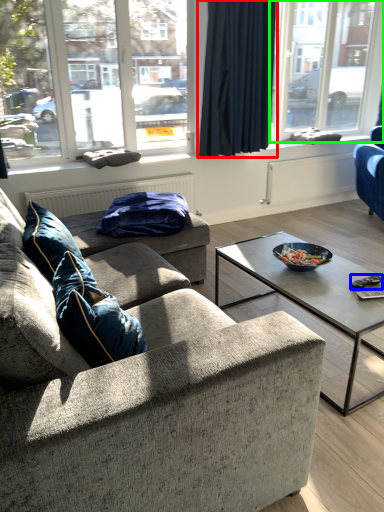
Question: Estimate the real-world distances between objects in this image. Which object is closer to curtain (highlighted by a red box), remote (highlighted by a blue box) or window (highlighted by a green box)?

Choices:
 (A) remote
 (B) window

Answer: (A)